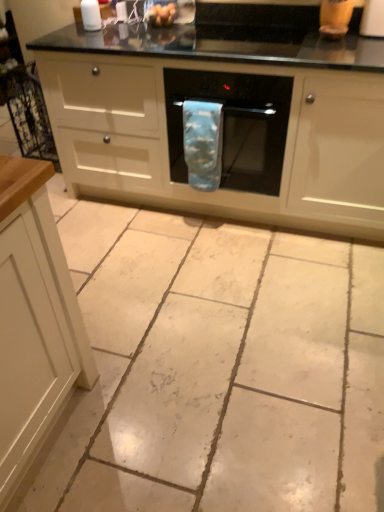
Where is `vacant area that is in front of black glass oven at center`? The width and height of the screenshot is (384, 512). vacant area that is in front of black glass oven at center is located at coordinates (225, 316).